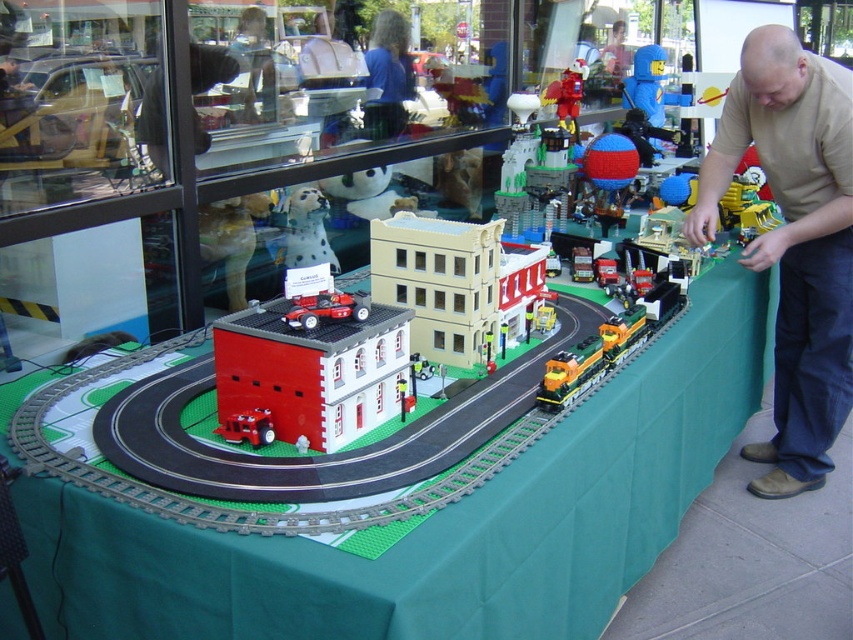
Does orange metallic train at center appear on the right side of blue and red glossy hot air balloon at center?

Incorrect, orange metallic train at center is not on the right side of blue and red glossy hot air balloon at center.

Who is more distant from viewer, (544, 376) or (625, 179)?

The point (625, 179) is more distant.

Between point (614, 342) and point (583, 170), which one is positioned behind?

The point (583, 170) is more distant.

You are a GUI agent. You are given a task and a screenshot of the screen. Output one action in this format:
    pyautogui.click(x=<x>, y=<y>)
    Task: Click on the orange metallic train at center
    
    Given the screenshot: What is the action you would take?
    pyautogui.click(x=590, y=358)

Who is positioned more to the left, green fabric tablecloth at center or brick red fire station at center?

From the viewer's perspective, brick red fire station at center appears more on the left side.

Who is higher up, green fabric tablecloth at center or brick red fire station at center?

brick red fire station at center is above.

Locate an element on the screen. green fabric tablecloth at center is located at coordinates (438, 518).

Which is more to the left, brown cotton shirt at right or matte red fire truck at center?

From the viewer's perspective, matte red fire truck at center appears more on the left side.

Does brown cotton shirt at right have a greater width compared to matte red fire truck at center?

Yes, brown cotton shirt at right is wider than matte red fire truck at center.

Who is more forward, (717, 200) or (247, 442)?

Positioned in front is point (247, 442).

Where is `brown cotton shirt at right`? This screenshot has width=853, height=640. brown cotton shirt at right is located at coordinates (793, 241).